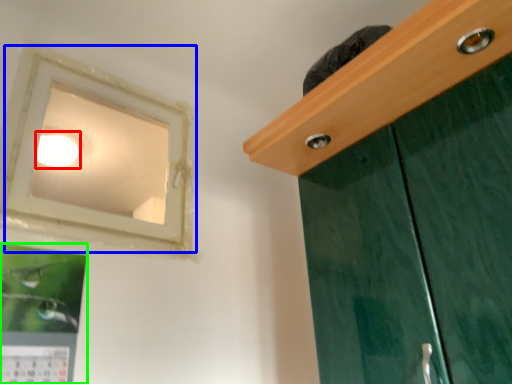
Question: Based on their relative distances, which object is farther from lighting (highlighted by a red box)? Choose from window (highlighted by a blue box) and picture frame (highlighted by a green box).

Choices:
 (A) window
 (B) picture frame

Answer: (B)